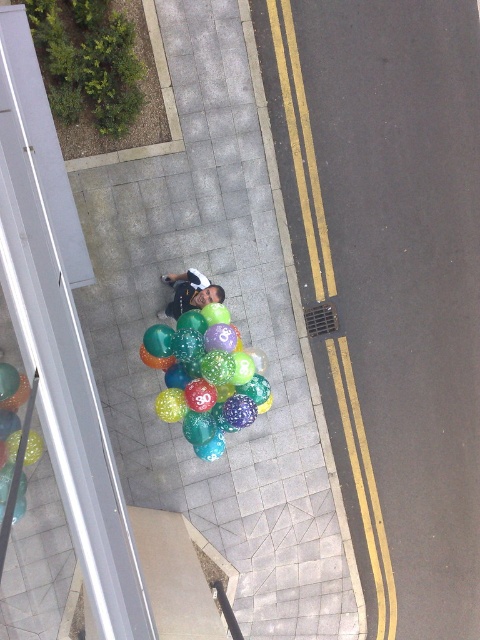
Question: Does shiny metallic balloon at center appear under matte black shirt at center?

Choices:
 (A) yes
 (B) no

Answer: (A)

Question: Which of these objects is positioned closest to the shiny metallic balloon at center?

Choices:
 (A) smooth concrete pavement at center
 (B) matte black shirt at center
 (C) translucent glossy balloons at center

Answer: (C)

Question: Among these points, which one is nearest to the camera?

Choices:
 (A) 188,301
 (B) 253,419
 (C) 188,493
 (D) 36,436

Answer: (D)

Question: From the image, what is the correct spatial relationship of translucent glossy balloons at center in relation to matte black shirt at center?

Choices:
 (A) above
 (B) below

Answer: (B)

Question: Which of the following is the farthest from the observer?

Choices:
 (A) matte black shirt at center
 (B) smooth concrete sidewalk at center

Answer: (B)

Question: Is smooth concrete sidewalk at center positioned at the back of smooth concrete pavement at center?

Choices:
 (A) no
 (B) yes

Answer: (B)